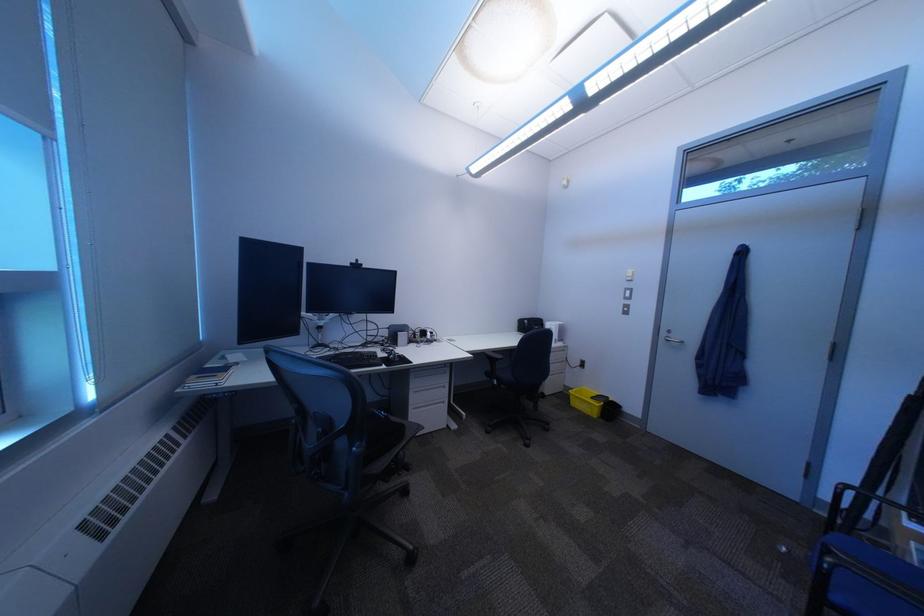
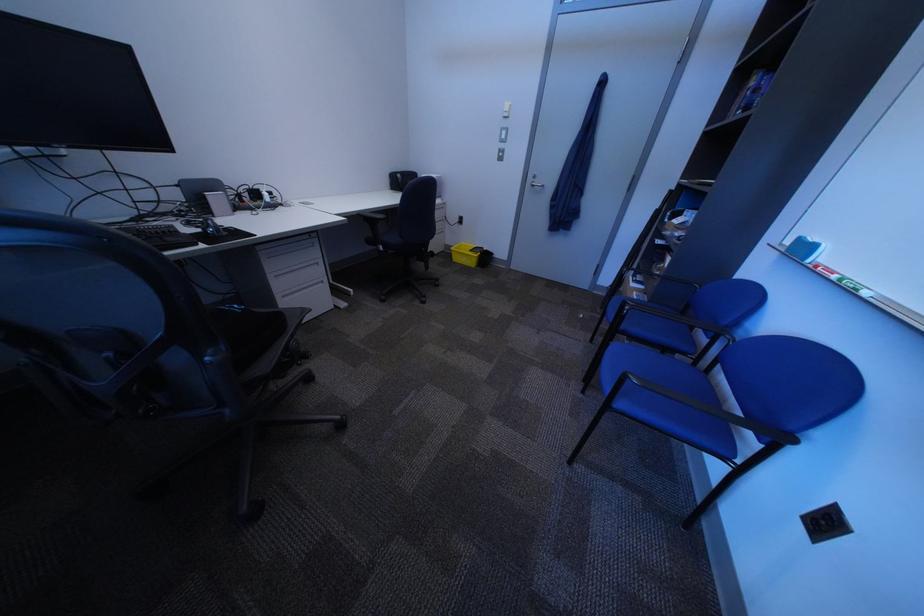
Where in the second image is the point corresponding to point 590,405 from the first image?

(470, 261)